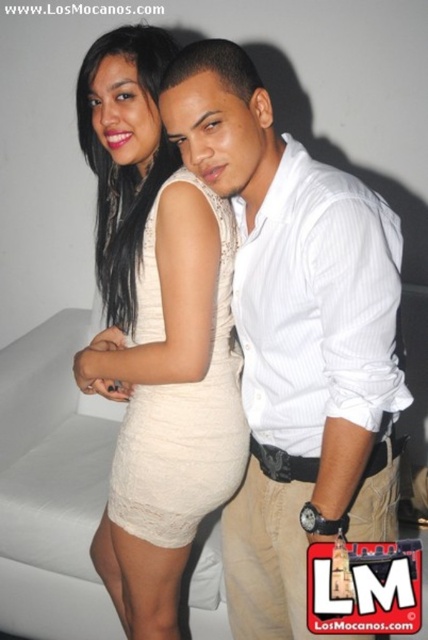
You are a photographer setting up for a portrait shoot. You need to position a 75 cm wide lighting reflector between the white striped shirt at center and the white fabric couch at lower left. Can the reflector fit in the space between them without overlapping either object?

The distance between the white striped shirt at center and the white fabric couch at lower left is 76.36 centimeters. Since the reflector is 75 cm wide, it can fit in the space as the available distance is slightly larger than the reflector.

You are a photographer setting up for a photoshoot. You need to place a 1.2 meter tall tripod between the white fabric couch at lower left and the lace beige dress at center. Is there enough vertical space between them for the tripod?

The white fabric couch at lower left is positioned under the lace beige dress at center, so there is sufficient vertical space for the 1.2 meter tall tripod between them.

You are a photographer setting up for a photoshoot. You need to place a 2.5 meter long equipment rack between the white fabric couch at lower left and the lace beige dress at center. Can the rack fit between them?

The white fabric couch at lower left might be wider than lace beige dress at center, but without exact measurements of the distance between them, it is uncertain if the 2.5 meter rack will fit. More information is needed to determine this.